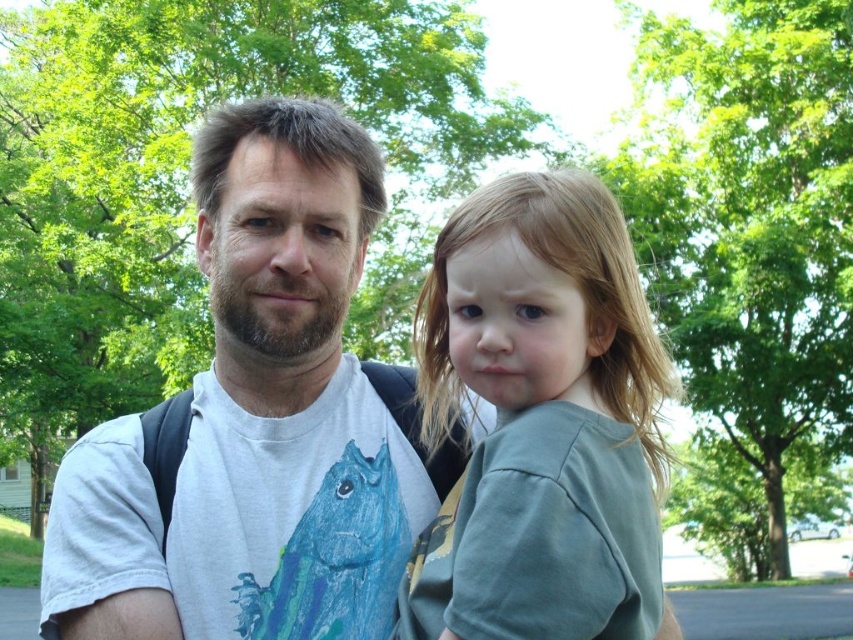
Who is positioned more to the right, white t-shirt at center or light brown hair at right?

light brown hair at right

Does white t-shirt at center appear on the left side of light brown hair at right?

Correct, you'll find white t-shirt at center to the left of light brown hair at right.

The height and width of the screenshot is (640, 853). What do you see at coordinates (259, 420) in the screenshot?
I see `white t-shirt at center` at bounding box center [259, 420].

I want to click on white t-shirt at center, so click(x=259, y=420).